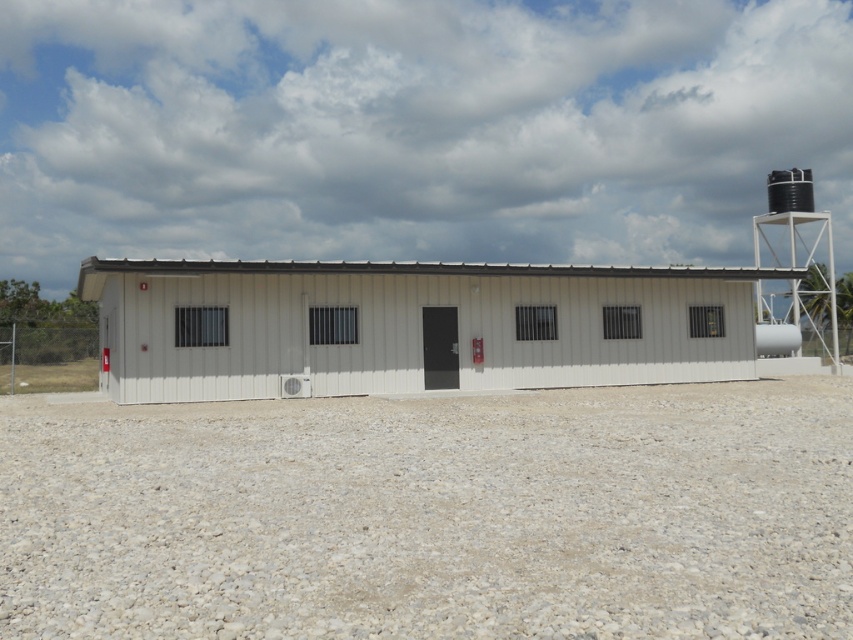
Question: Does gray gravel at center have a lesser width compared to white corrugated metal shed at center?

Choices:
 (A) no
 (B) yes

Answer: (B)

Question: Which object is farther from the camera taking this photo?

Choices:
 (A) black matte water tower at upper right
 (B) white corrugated metal shed at center
 (C) gray gravel at center

Answer: (A)

Question: Which point appears farthest from the camera in this image?

Choices:
 (A) (583, 285)
 (B) (769, 356)
 (C) (451, 467)

Answer: (B)

Question: Is white corrugated metal shed at center closer to the viewer compared to black matte water tower at upper right?

Choices:
 (A) yes
 (B) no

Answer: (A)

Question: Which object is positioned farthest from the gray gravel at center?

Choices:
 (A) black matte water tower at upper right
 (B) white corrugated metal shed at center

Answer: (A)

Question: Is white corrugated metal shed at center wider than black matte water tower at upper right?

Choices:
 (A) no
 (B) yes

Answer: (A)